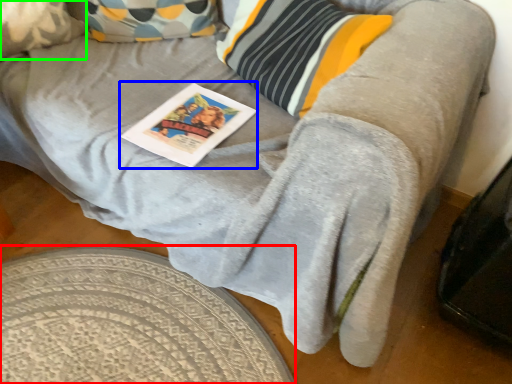
Question: Which object is the farthest from round table (highlighted by a red box)? Choose among these: magazine (highlighted by a blue box) or pillow (highlighted by a green box).

Choices:
 (A) magazine
 (B) pillow

Answer: (B)